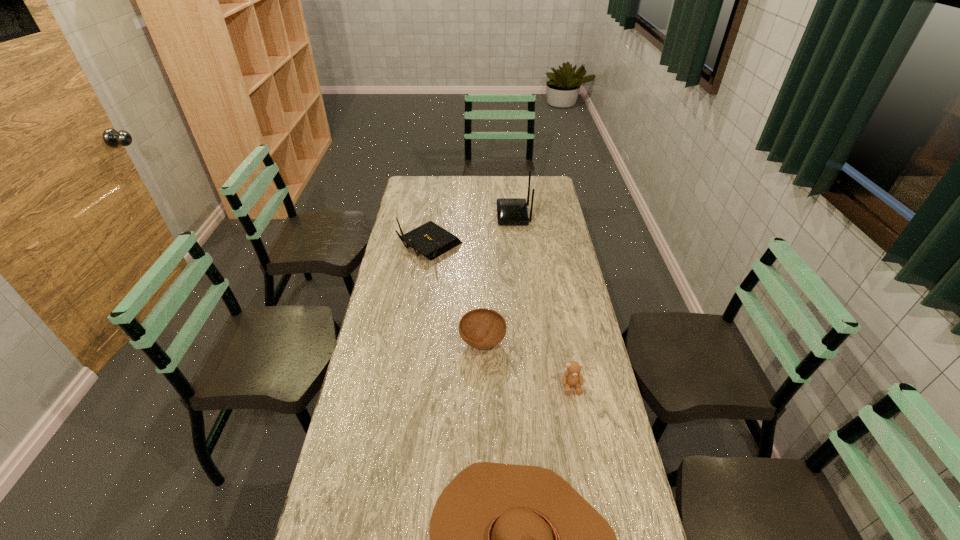
I want to click on the right router, so click(510, 211).

You are a GUI agent. You are given a task and a screenshot of the screen. Output one action in this format:
    pyautogui.click(x=<x>, y=<y>)
    Task: Click on the tallest object
    
    Given the screenshot: What is the action you would take?
    pyautogui.click(x=510, y=211)

Where is `the left router`? the left router is located at coordinates (430, 240).

Locate an element on the screen. the second tallest object is located at coordinates (430, 240).

Locate an element on the screen. teddy bear is located at coordinates (572, 377).

Identify the location of bowl. (482, 328).

At what (x,y) coordinates should I click in order to perform the action: click on blank space located on the front-facing side of the taller router. Please return your answer as a coordinate pair (x, y). This screenshot has height=540, width=960. Looking at the image, I should click on (472, 215).

Identify the location of vacant space located 0.140m on the front-facing side of the taller router. This screenshot has height=540, width=960. (468, 215).

This screenshot has width=960, height=540. What are the coordinates of `vacant space located on the front-facing side of the taller router` in the screenshot? It's located at (421, 215).

This screenshot has height=540, width=960. What are the coordinates of `blank space located 0.210m on the back of the fourth shortest object` in the screenshot? It's located at (436, 203).